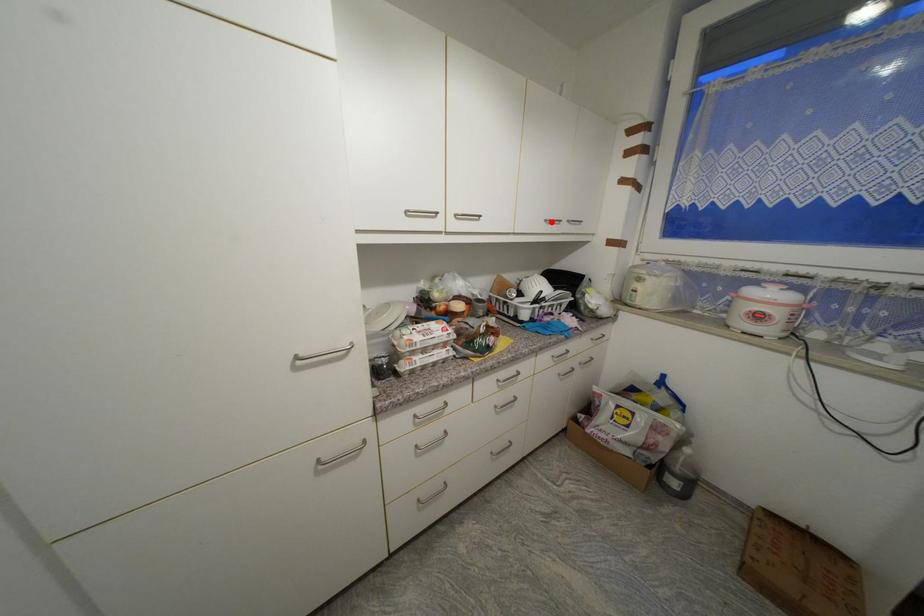
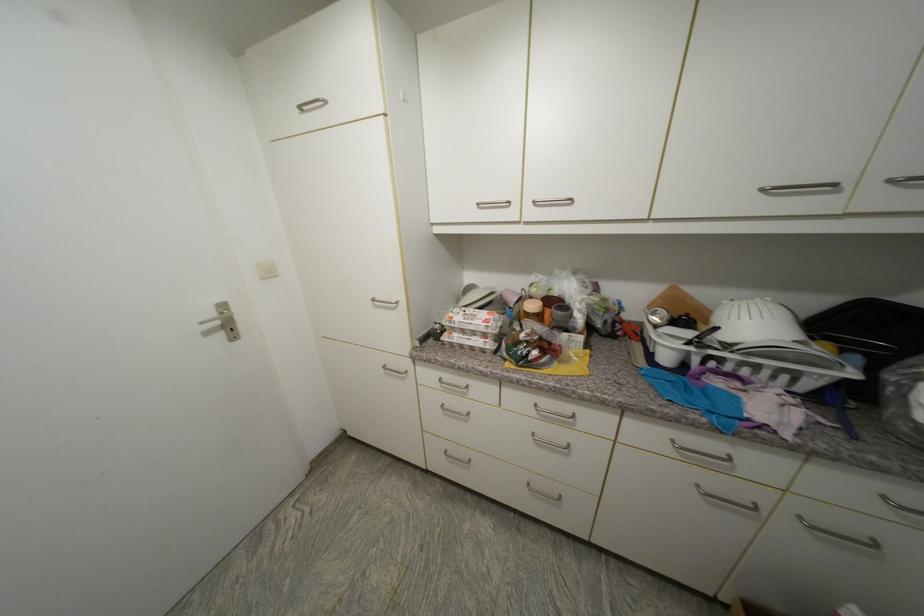
In the second image, find the point that corresponds to the highlighted location in the first image.

(768, 191)